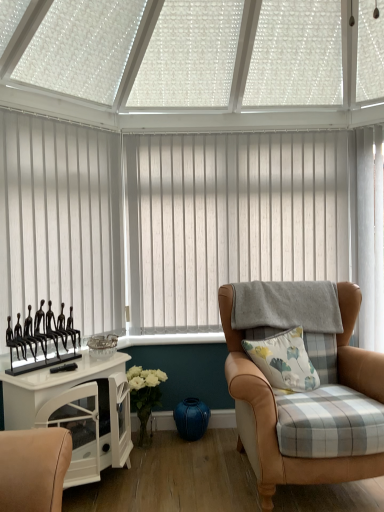
Question: Is white vertical blinds at center, placed as the second window blind when sorted from left to right, beside white floral-patterned cushion at center-right?

Choices:
 (A) no
 (B) yes

Answer: (A)

Question: Is white vertical blinds at center, the 2th window blind positioned from the front, to the right of white floral-patterned cushion at center-right from the viewer's perspective?

Choices:
 (A) no
 (B) yes

Answer: (A)

Question: Is white vertical blinds at center, the first window blind in the back-to-front sequence, bigger than white floral-patterned cushion at center-right?

Choices:
 (A) no
 (B) yes

Answer: (B)

Question: From a real-world perspective, does white vertical blinds at center, the 2th window blind positioned from the front, stand above white floral-patterned cushion at center-right?

Choices:
 (A) yes
 (B) no

Answer: (A)

Question: From the image's perspective, would you say white vertical blinds at center, the 2th window blind positioned from the front, is shown under white floral-patterned cushion at center-right?

Choices:
 (A) yes
 (B) no

Answer: (B)

Question: From a real-world perspective, is white vertical blinds at center, marked as the first window blind in a right-to-left arrangement, positioned above or below leather armchair at right?

Choices:
 (A) below
 (B) above

Answer: (B)

Question: Considering the positions of white vertical blinds at center, the 2th window blind positioned from the front, and leather armchair at right in the image, is white vertical blinds at center, the 2th window blind positioned from the front, taller or shorter than leather armchair at right?

Choices:
 (A) tall
 (B) short

Answer: (A)

Question: Is white vertical blinds at center, the 2th window blind positioned from the front, wider or thinner than leather armchair at right?

Choices:
 (A) thin
 (B) wide

Answer: (A)

Question: Is point (299, 190) positioned closer to the camera than point (347, 350)?

Choices:
 (A) farther
 (B) closer

Answer: (A)

Question: Is white glossy cabinet at left wider or thinner than white floral-patterned cushion at center-right?

Choices:
 (A) thin
 (B) wide

Answer: (B)

Question: Do you think white glossy cabinet at left is within white floral-patterned cushion at center-right, or outside of it?

Choices:
 (A) inside
 (B) outside

Answer: (B)

Question: In terms of height, does white glossy cabinet at left look taller or shorter compared to white floral-patterned cushion at center-right?

Choices:
 (A) short
 (B) tall

Answer: (B)

Question: From the image's perspective, is white glossy cabinet at left positioned above or below white floral-patterned cushion at center-right?

Choices:
 (A) above
 (B) below

Answer: (B)

Question: Considering the relative positions of white vertical blinds at left, which is the 2th window blind from back to front, and white glossy cabinet at left in the image provided, is white vertical blinds at left, which is the 2th window blind from back to front, to the left or to the right of white glossy cabinet at left?

Choices:
 (A) right
 (B) left

Answer: (B)

Question: Does point (21, 144) appear closer or farther from the camera than point (125, 403)?

Choices:
 (A) closer
 (B) farther

Answer: (A)